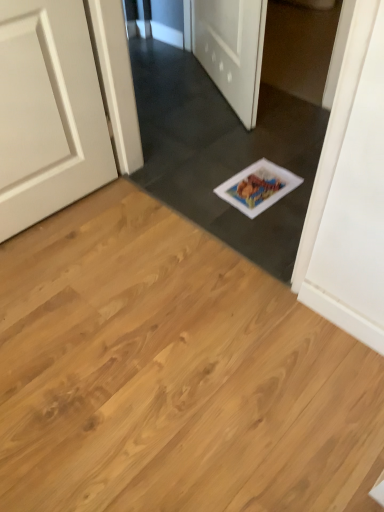
I want to click on natural wood flooring at center, so click(x=172, y=374).

What do you see at coordinates (172, 374) in the screenshot? I see `natural wood flooring at center` at bounding box center [172, 374].

This screenshot has width=384, height=512. Find the location of `natural wood flooring at center`. natural wood flooring at center is located at coordinates (172, 374).